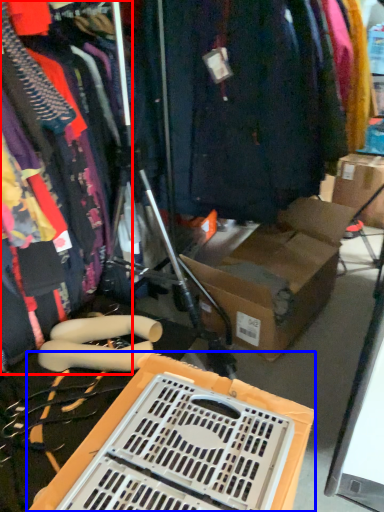
Question: Which point is closer to the camera, clothing (highlighted by a red box) or storage box (highlighted by a blue box)?

Choices:
 (A) clothing
 (B) storage box

Answer: (A)